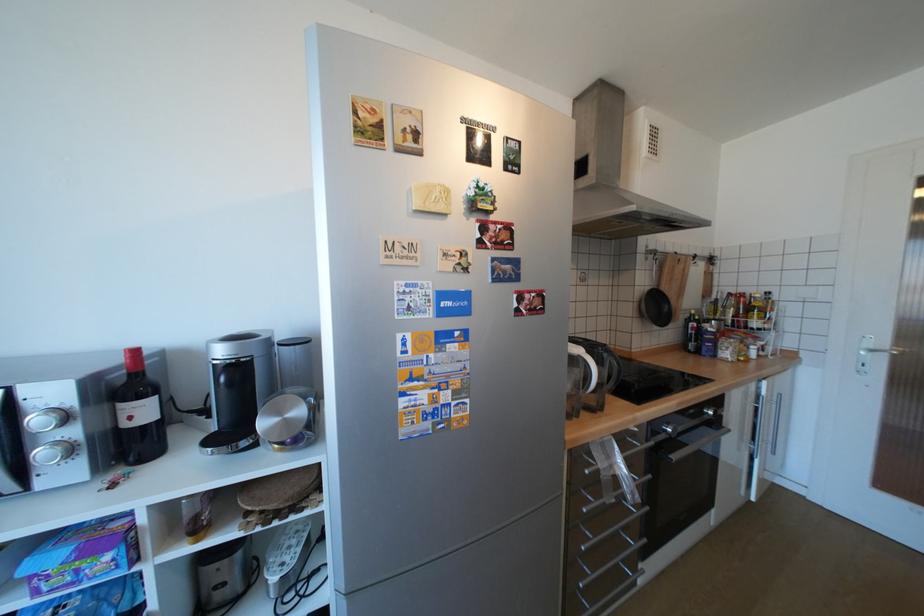
Where would you lift the blue milk carton? Please return your answer as a coordinate pair (x, y).

(81, 554)